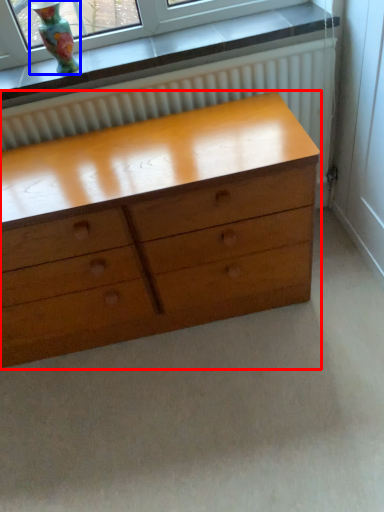
Question: Which object is further to the camera taking this photo, chest of drawers (highlighted by a red box) or vase (highlighted by a blue box)?

Choices:
 (A) chest of drawers
 (B) vase

Answer: (B)